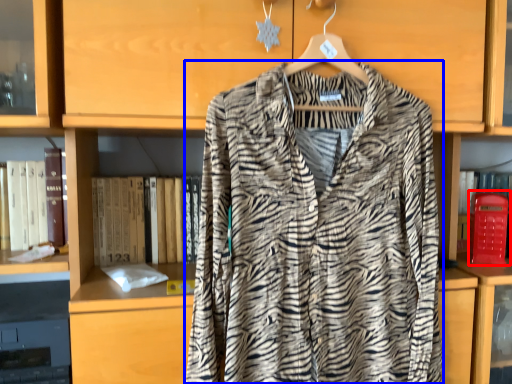
Question: Which of the following is the closest to the observer, phone box (highlighted by a red box) or fancy dress (highlighted by a blue box)?

Choices:
 (A) phone box
 (B) fancy dress

Answer: (B)